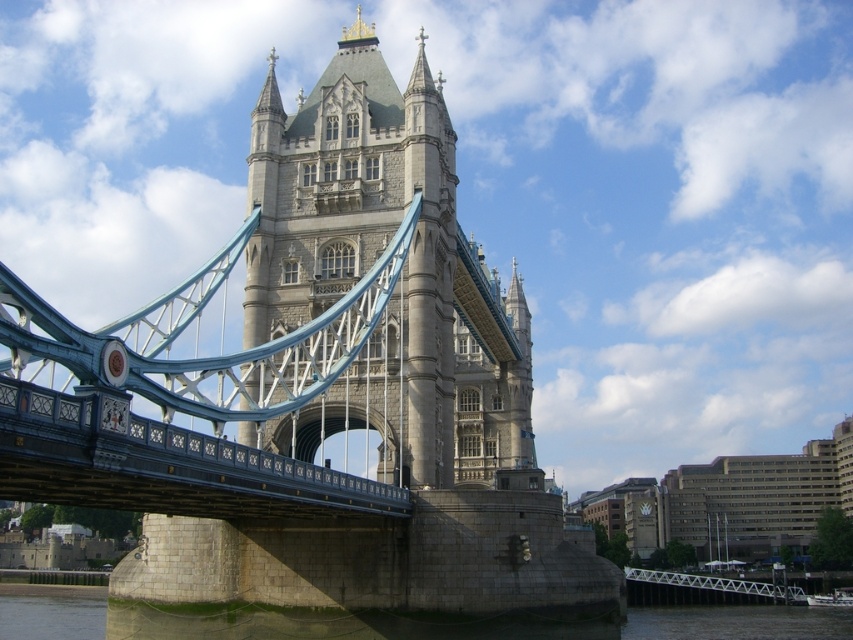
Question: Where is stone suspension bridge at center located in relation to gray stone river at lower center in the image?

Choices:
 (A) below
 (B) above

Answer: (B)

Question: Based on their relative distances, which object is farther from the gray stone river at lower center?

Choices:
 (A) gray stone tower at center
 (B) white metallic bridge at lower right
 (C) stone suspension bridge at center

Answer: (A)

Question: Does stone suspension bridge at center have a greater width compared to gray stone tower at center?

Choices:
 (A) yes
 (B) no

Answer: (A)

Question: Does gray stone tower at center have a larger size compared to gray stone river at lower center?

Choices:
 (A) yes
 (B) no

Answer: (B)

Question: Which point is farther to the camera?

Choices:
 (A) gray stone river at lower center
 (B) gray stone tower at center
 (C) white metallic bridge at lower right

Answer: (C)

Question: Which point is closer to the camera taking this photo?

Choices:
 (A) (711, 616)
 (B) (730, 582)
 (C) (265, 333)

Answer: (C)